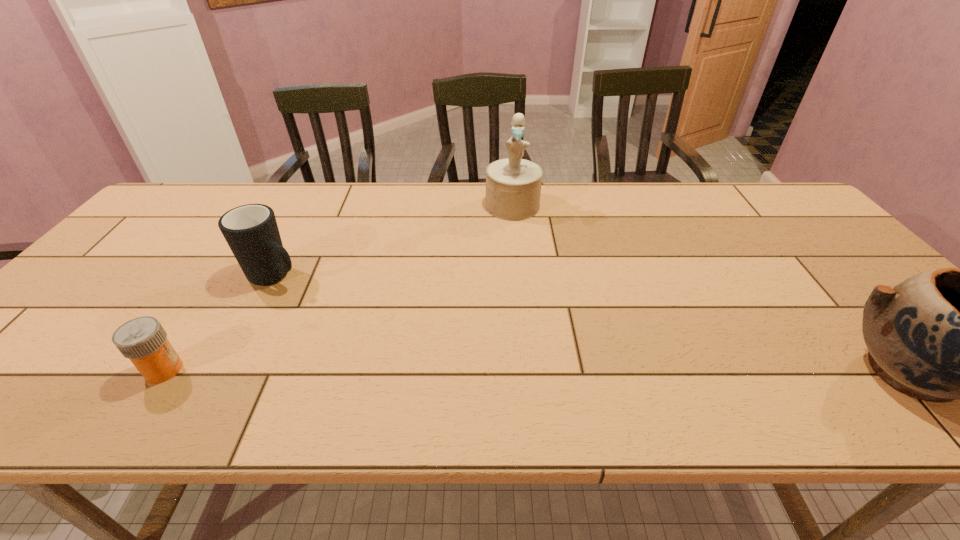
You are a GUI agent. You are given a task and a screenshot of the screen. Output one action in this format:
    pyautogui.click(x=<x>, y=<y>)
    Task: Click on the vacant position located at the beak of the tallest object
    This screenshot has height=540, width=960.
    Given the screenshot: What is the action you would take?
    pyautogui.click(x=513, y=231)

Find the location of a particular element. free space located at the beak of the tallest object is located at coordinates (513, 295).

This screenshot has height=540, width=960. Identify the location of vacant space located at the beak of the tallest object. (513, 295).

The width and height of the screenshot is (960, 540). In order to click on object that is positioned at the far edge in this screenshot , I will do `click(513, 185)`.

You are a GUI agent. You are given a task and a screenshot of the screen. Output one action in this format:
    pyautogui.click(x=<x>, y=<y>)
    Task: Click on the object present at the near edge
    Image resolution: width=960 pixels, height=540 pixels.
    Given the screenshot: What is the action you would take?
    pyautogui.click(x=143, y=340)

At what (x,y) coordinates should I click in order to perform the action: click on vacant space at the far edge. Please return your answer as a coordinate pair (x, y). Looking at the image, I should click on [565, 193].

At what (x,y) coordinates should I click in order to perform the action: click on blank space at the near edge of the desktop. Please return your answer as a coordinate pair (x, y). The height and width of the screenshot is (540, 960). Looking at the image, I should click on (127, 372).

Where is `blank space at the left edge`? Image resolution: width=960 pixels, height=540 pixels. blank space at the left edge is located at coordinates (118, 251).

This screenshot has height=540, width=960. In the image, there is a desktop. What are the coordinates of `vacant space at the right edge` in the screenshot? It's located at (826, 235).

This screenshot has width=960, height=540. Identify the location of vacant space at the far left corner of the desktop. (180, 221).